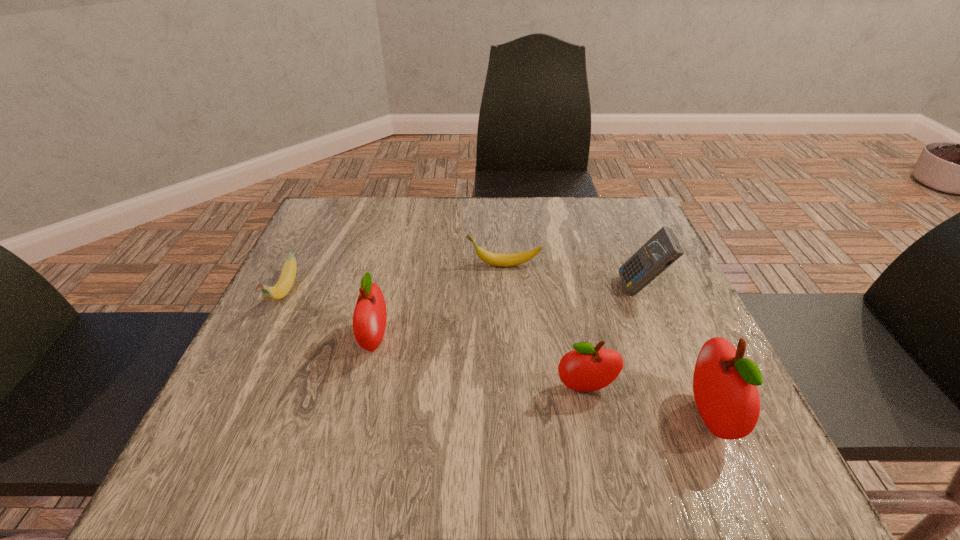
Find the location of a particular element. Image resolution: width=960 pixels, height=540 pixels. calculator located in the right edge section of the desktop is located at coordinates (663, 249).

I want to click on object positioned at the near right corner, so click(x=725, y=384).

I want to click on blank area at the far edge, so click(398, 217).

Identify the location of free space at the right edge of the desktop. This screenshot has width=960, height=540. (680, 283).

At what (x,y) coordinates should I click in order to perform the action: click on vacant space at the far left corner of the desktop. Please return your answer as a coordinate pair (x, y). Looking at the image, I should click on (342, 207).

Where is `vacant space at the near left corner of the desktop`? vacant space at the near left corner of the desktop is located at coordinates (253, 424).

This screenshot has width=960, height=540. Find the location of `blank space at the far right corner of the desktop`. blank space at the far right corner of the desktop is located at coordinates (633, 203).

The width and height of the screenshot is (960, 540). In the image, there is a desktop. Find the location of `free space at the near right corner`. free space at the near right corner is located at coordinates (658, 394).

The width and height of the screenshot is (960, 540). I want to click on unoccupied position between the right banana and the second apple from left to right, so click(544, 327).

The width and height of the screenshot is (960, 540). In order to click on vacant point located between the rightmost apple and the fifth object from right to left in this screenshot , I will do `click(541, 378)`.